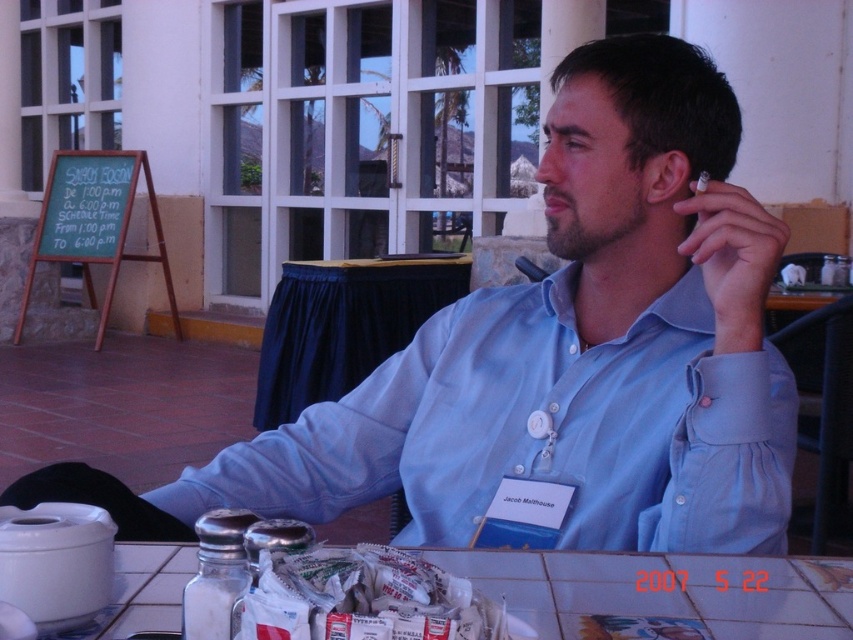
Question: Can you confirm if light blue button-down shirt at center is wider than dark blue fabric table at center?

Choices:
 (A) no
 (B) yes

Answer: (A)

Question: Which object appears farthest from the camera in this image?

Choices:
 (A) dark blue fabric table at center
 (B) light blue button-down shirt at center
 (C) white tile table at lower center

Answer: (A)

Question: Is light blue button-down shirt at center below white paper packets at lower center?

Choices:
 (A) no
 (B) yes

Answer: (A)

Question: Which point is farther from the camera taking this photo?

Choices:
 (A) (312, 365)
 (B) (532, 433)

Answer: (A)

Question: Among these objects, which one is nearest to the camera?

Choices:
 (A) dark blue fabric table at center
 (B) light blue button-down shirt at center
 (C) white tile table at lower center
 (D) white paper packets at lower center

Answer: (D)

Question: Does white tile table at lower center appear under white paper packets at lower center?

Choices:
 (A) yes
 (B) no

Answer: (A)